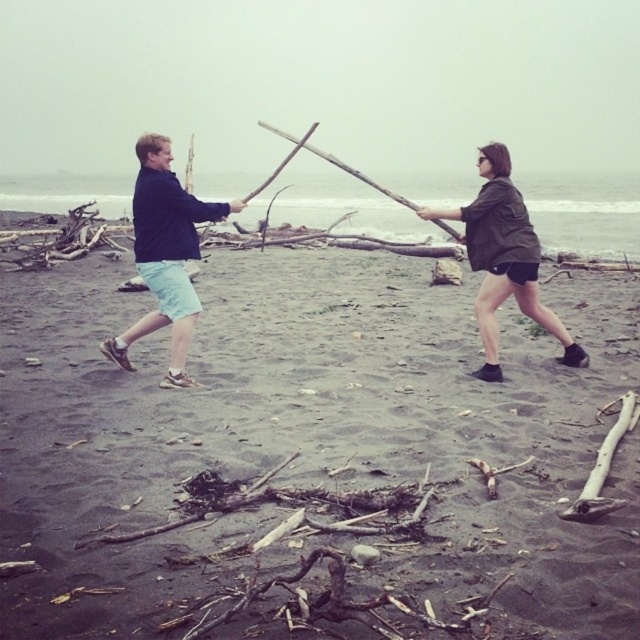
Question: Can you confirm if dark sand driftwood at center is positioned above light blue shorts at left?

Choices:
 (A) no
 (B) yes

Answer: (A)

Question: Does dark sand driftwood at center have a lesser width compared to matte green jacket at center?

Choices:
 (A) yes
 (B) no

Answer: (B)

Question: Does dark sand driftwood at center have a smaller size compared to matte green jacket at center?

Choices:
 (A) yes
 (B) no

Answer: (B)

Question: Estimate the real-world distances between objects in this image. Which object is farther from the dark sand driftwood at center?

Choices:
 (A) matte green jacket at center
 (B) light blue shorts at left

Answer: (B)

Question: Considering the real-world distances, which object is farthest from the dark sand driftwood at center?

Choices:
 (A) light blue shorts at left
 (B) matte green jacket at center

Answer: (A)

Question: Which of the following is the farthest from the observer?

Choices:
 (A) (118, 333)
 (B) (202, 340)

Answer: (A)